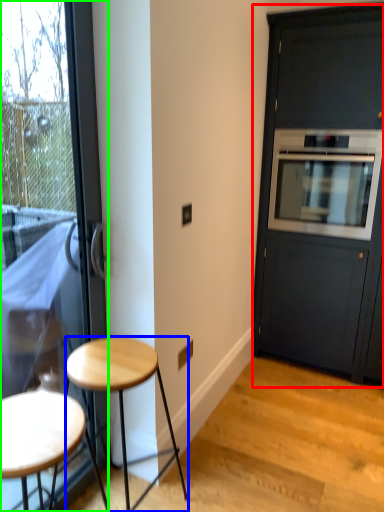
Question: Which object is the farthest from cabinetry (highlighted by a red box)? Choose among these: stool (highlighted by a blue box) or door (highlighted by a green box).

Choices:
 (A) stool
 (B) door

Answer: (A)